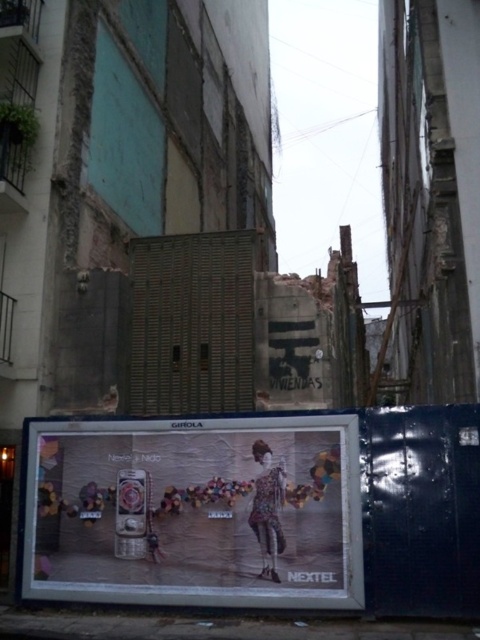
You are a delivery person trying to place both the matte silver phone at center and the floral fabric dress at center into a rectangular box. The box can only accommodate items that are narrower than the dress. Will both items fit?

The matte silver phone at center is wider than the floral fabric dress at center. Since the box can only accommodate items narrower than the dress, the phone won

You are standing in the alleyway and see two points marked in the image. If you were to walk directly towards the point at coordinates point (40, 563), would you pass by the point at point (263, 493) first?

Yes, because point (40, 563) is behind point (263, 493), so walking towards the former would require passing the latter first.